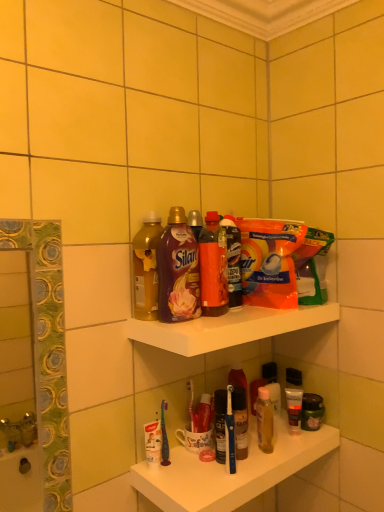
I want to click on space that is in front of translucent orange bottle at center, the first bottle when ordered from right to left, so 211,321.